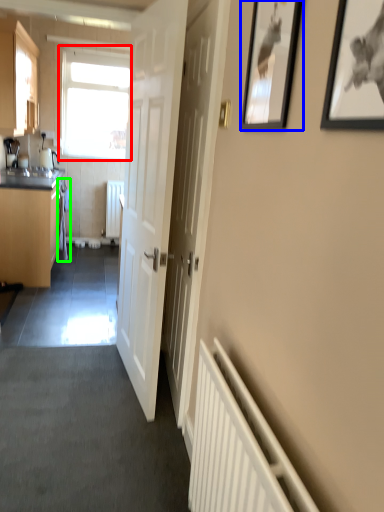
Question: Considering the real-world distances, which object is closest to window (highlighted by a red box)? picture frame (highlighted by a blue box) or laundry (highlighted by a green box).

Choices:
 (A) picture frame
 (B) laundry

Answer: (B)